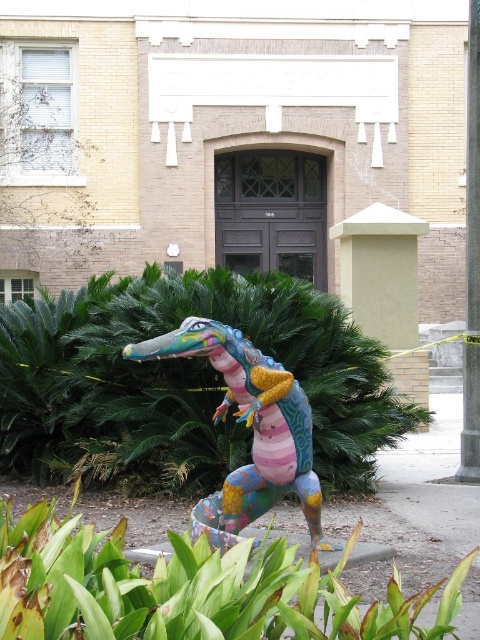
Question: Considering the relative positions of green leafy plant at center and multicolored painted crocodile at center in the image provided, where is green leafy plant at center located with respect to multicolored painted crocodile at center?

Choices:
 (A) above
 (B) below

Answer: (A)

Question: Estimate the real-world distances between objects in this image. Which object is closer to the smooth gray pole at right?

Choices:
 (A) multicolored painted crocodile at center
 (B) green leafy plant at lower center
 (C) green leafy plant at center

Answer: (C)

Question: Is multicolored painted crocodile at center in front of smooth gray pole at right?

Choices:
 (A) yes
 (B) no

Answer: (A)

Question: Does green leafy plant at lower center appear over multicolored painted crocodile at center?

Choices:
 (A) no
 (B) yes

Answer: (A)

Question: Estimate the real-world distances between objects in this image. Which object is closer to the green leafy plant at center?

Choices:
 (A) green leafy plant at lower center
 (B) multicolored painted crocodile at center

Answer: (B)

Question: Among these points, which one is nearest to the camera?

Choices:
 (A) (48, 570)
 (B) (478, 214)

Answer: (A)